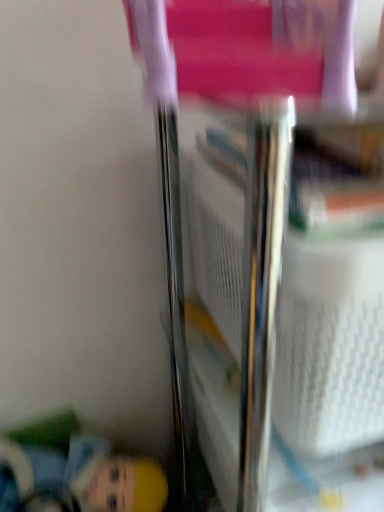
This screenshot has width=384, height=512. What do you see at coordinates (74, 472) in the screenshot?
I see `plastic yellow toy at lower left` at bounding box center [74, 472].

What is the approximate width of plastic yellow toy at lower left?

plastic yellow toy at lower left is 7.39 inches in width.

Locate an element on the screen. The image size is (384, 512). plastic yellow toy at lower left is located at coordinates (74, 472).

I want to click on plastic yellow toy at lower left, so click(x=74, y=472).